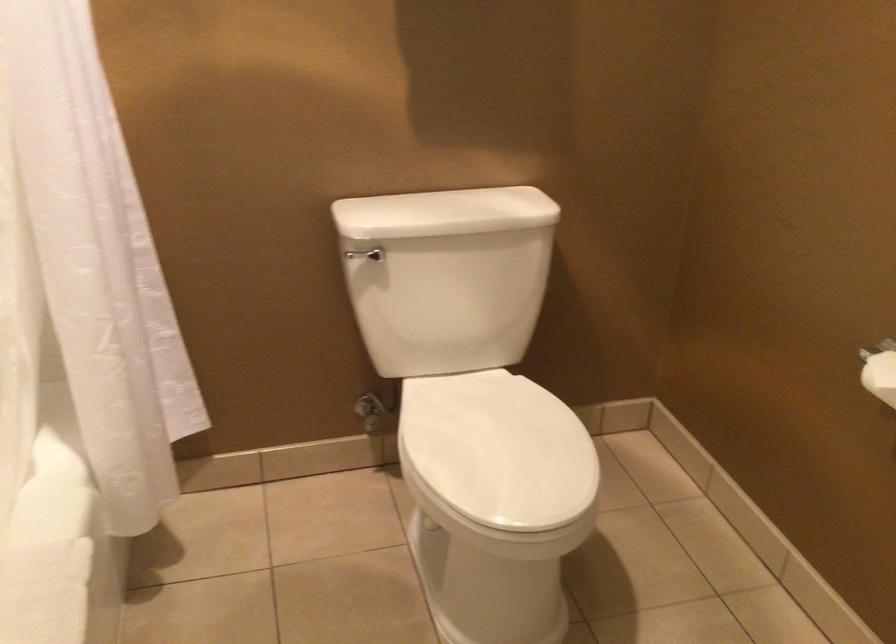
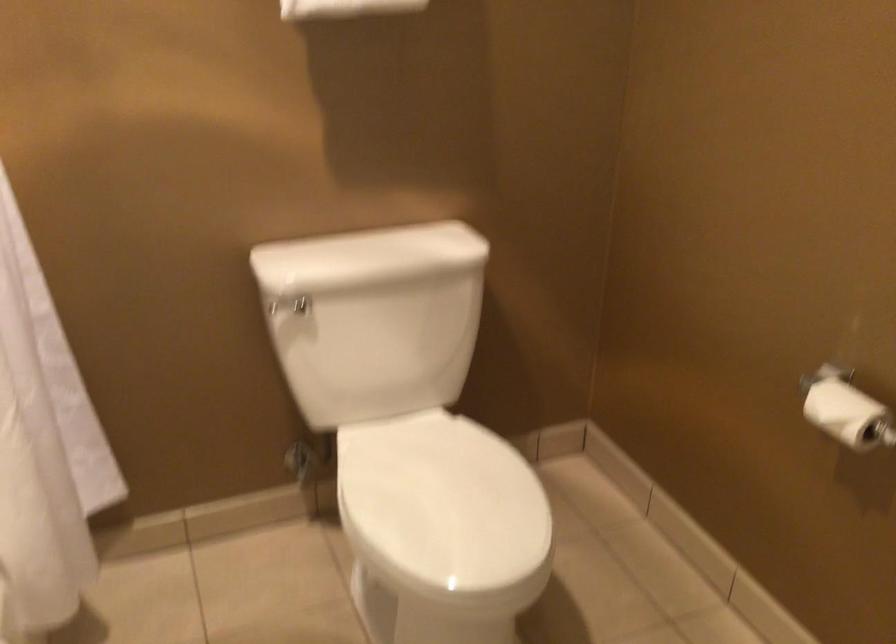
In the second image, find the point that corresponds to (x=495, y=449) in the first image.

(442, 505)